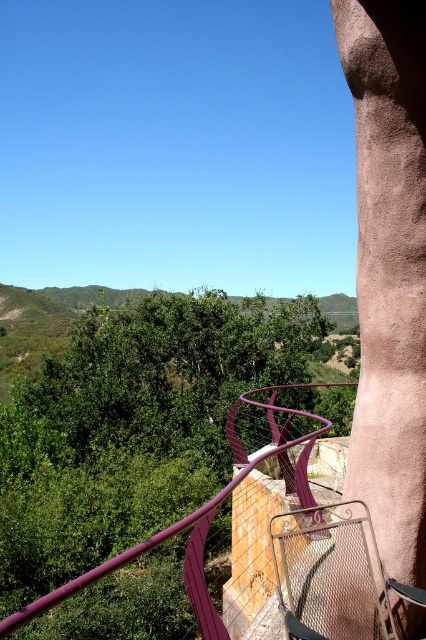
You are standing on the balcony and want to take a photo of the green leafy tree at center and the purple metallic railing at upper right. Which object will appear larger in the photo?

The green leafy tree at center will appear larger in the photo because it is closer to the viewer than the purple metallic railing at upper right.

You are standing on the balcony and looking out. There are two points marked in the scene. The first point is at coordinates point [154,328] and the second is at point [2,624]. Which point is closer to you?

Point [154,328] is closer to you because it is further to the viewer than point [2,624].